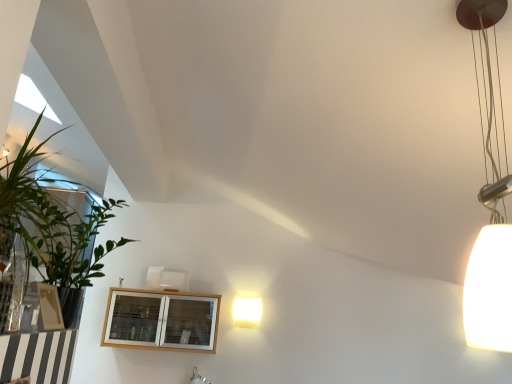
Question: Considering the relative sizes of white matte lampshade at right, marked as the 2th lamp in a back-to-front arrangement, and green leafy plant at left in the image provided, is white matte lampshade at right, marked as the 2th lamp in a back-to-front arrangement, taller than green leafy plant at left?

Choices:
 (A) no
 (B) yes

Answer: (B)

Question: Is white matte lampshade at right, which ranks as the 2th lamp in bottom-to-top order, thinner than green leafy plant at left?

Choices:
 (A) yes
 (B) no

Answer: (A)

Question: Can you confirm if white matte lampshade at right, marked as the 2th lamp in a back-to-front arrangement, is wider than green leafy plant at left?

Choices:
 (A) no
 (B) yes

Answer: (A)

Question: From a real-world perspective, is white matte lampshade at right, which is counted as the 2th lamp, starting from the left, located beneath green leafy plant at left?

Choices:
 (A) no
 (B) yes

Answer: (A)

Question: Considering the relative sizes of white matte lampshade at right, which is the 1th lamp in front-to-back order, and green leafy plant at left in the image provided, is white matte lampshade at right, which is the 1th lamp in front-to-back order, bigger than green leafy plant at left?

Choices:
 (A) no
 (B) yes

Answer: (A)

Question: Is white matte lampshade at right, which ranks as the first lamp in right-to-left order, directly adjacent to green leafy plant at left?

Choices:
 (A) no
 (B) yes

Answer: (A)

Question: Is wooden cabinet at lower left surrounding green leafy plant at left?

Choices:
 (A) yes
 (B) no

Answer: (B)

Question: Is wooden cabinet at lower left located outside green leafy plant at left?

Choices:
 (A) yes
 (B) no

Answer: (A)

Question: Is wooden cabinet at lower left oriented away from green leafy plant at left?

Choices:
 (A) yes
 (B) no

Answer: (B)

Question: Could you tell me if wooden cabinet at lower left is turned towards green leafy plant at left?

Choices:
 (A) yes
 (B) no

Answer: (A)

Question: Can you confirm if wooden cabinet at lower left is thinner than green leafy plant at left?

Choices:
 (A) yes
 (B) no

Answer: (B)

Question: Is there a large distance between wooden cabinet at lower left and green leafy plant at left?

Choices:
 (A) no
 (B) yes

Answer: (B)

Question: Does wooden cabinet at lower left lie in front of matte white lamp at center, which appears as the 2th lamp when viewed from the top?

Choices:
 (A) no
 (B) yes

Answer: (B)